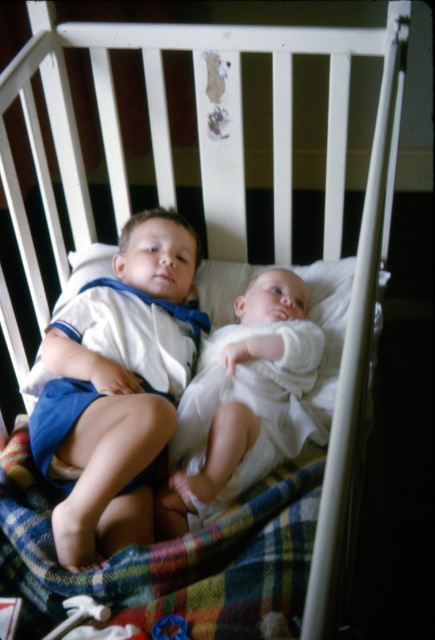
Question: Among these objects, which one is farthest from the camera?

Choices:
 (A) white cotton shirt at center
 (B) white soft baby at center
 (C) plaid fabric at center

Answer: (B)

Question: Does plaid fabric at center have a lesser width compared to white soft baby at center?

Choices:
 (A) no
 (B) yes

Answer: (A)

Question: Which point is farther to the camera?

Choices:
 (A) white cotton shirt at center
 (B) white soft baby at center

Answer: (B)

Question: Where is white cotton shirt at center located in relation to white soft baby at center in the image?

Choices:
 (A) right
 (B) left

Answer: (B)

Question: Estimate the real-world distances between objects in this image. Which object is farther from the white cotton shirt at center?

Choices:
 (A) plaid fabric at center
 (B) white soft baby at center

Answer: (A)

Question: Is plaid fabric at center bigger than white soft baby at center?

Choices:
 (A) no
 (B) yes

Answer: (B)